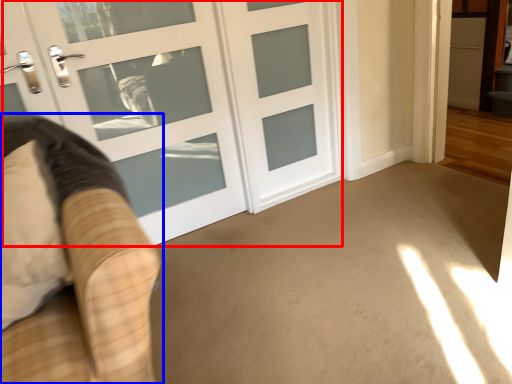
Question: Which object appears farthest to the camera in this image, door (highlighted by a red box) or furniture (highlighted by a blue box)?

Choices:
 (A) door
 (B) furniture

Answer: (A)